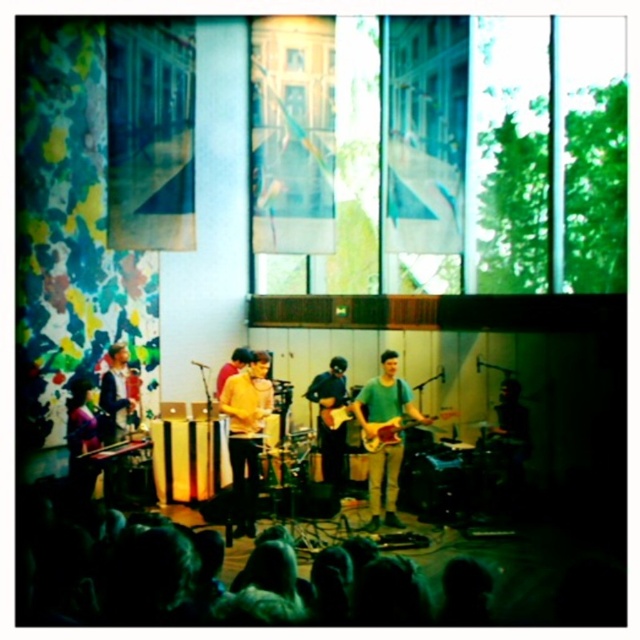
Question: Which point is closer to the camera taking this photo?

Choices:
 (A) (244, 442)
 (B) (346, 406)
 (C) (403, 442)
 (D) (326, 445)

Answer: (A)

Question: Considering the relative positions of wooden electric guitar at center and wooden acoustic guitar at center in the image provided, where is wooden electric guitar at center located with respect to wooden acoustic guitar at center?

Choices:
 (A) right
 (B) left

Answer: (A)

Question: Which point is closer to the camera taking this photo?

Choices:
 (A) (260, 417)
 (B) (342, 394)
 (C) (355, 401)

Answer: (A)

Question: Can you confirm if shiny black guitar at center is thinner than wooden electric guitar at center?

Choices:
 (A) no
 (B) yes

Answer: (B)

Question: Is wooden electric guitar at center positioned before wooden acoustic guitar at center?

Choices:
 (A) yes
 (B) no

Answer: (A)

Question: Estimate the real-world distances between objects in this image. Which object is closer to the matte yellow shirt at center?

Choices:
 (A) green matte guitar at center
 (B) shiny black guitar at center
 (C) wooden electric guitar at center
 (D) wooden acoustic guitar at center

Answer: (A)